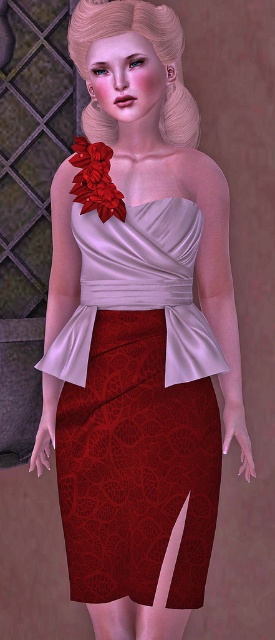
Question: Among these points, which one is farthest from the camera?

Choices:
 (A) pos(88,172)
 (B) pos(97,365)

Answer: (B)

Question: In this image, where is velvet red skirt at center located relative to shiny red fabric flower at upper center?

Choices:
 (A) below
 (B) above

Answer: (A)

Question: Can you confirm if velvet red skirt at center is wider than shiny red fabric flower at upper center?

Choices:
 (A) no
 (B) yes

Answer: (B)

Question: Can you confirm if velvet red skirt at center is positioned to the right of shiny red fabric flower at upper center?

Choices:
 (A) no
 (B) yes

Answer: (B)

Question: Which object appears closest to the camera in this image?

Choices:
 (A) velvet red skirt at center
 (B) shiny red fabric flower at upper center

Answer: (A)